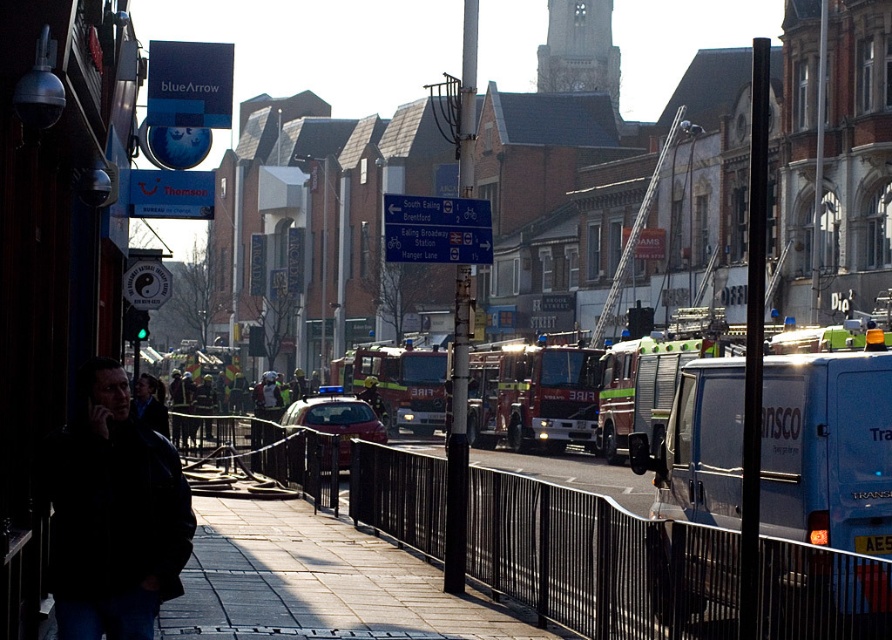
Which is above, blue metallic van at center right or dark blue jacket at lower left?

Positioned higher is blue metallic van at center right.

Find the location of a particular element. This screenshot has height=640, width=892. blue metallic van at center right is located at coordinates (787, 484).

Identify the location of blue metallic van at center right. (787, 484).

In the scene shown: Between red metallic fire truck at center and metallic red car at center, which one appears on the left side from the viewer's perspective?

Positioned to the left is metallic red car at center.

Can you confirm if red metallic fire truck at center is wider than metallic red car at center?

Indeed, red metallic fire truck at center has a greater width compared to metallic red car at center.

Between point (434, 428) and point (320, 408), which one is positioned in front?

Point (320, 408) is in front.

Where is `red metallic fire truck at center`? red metallic fire truck at center is located at coordinates (401, 384).

Is point (48, 483) positioned in front of point (581, 372)?

That is True.

At what (x,y) coordinates should I click in order to perform the action: click on black leather jacket at left. Please return your answer as a coordinate pair (x, y). Looking at the image, I should click on (113, 515).

This screenshot has width=892, height=640. What are the coordinates of `black leather jacket at left` in the screenshot? It's located at (113, 515).